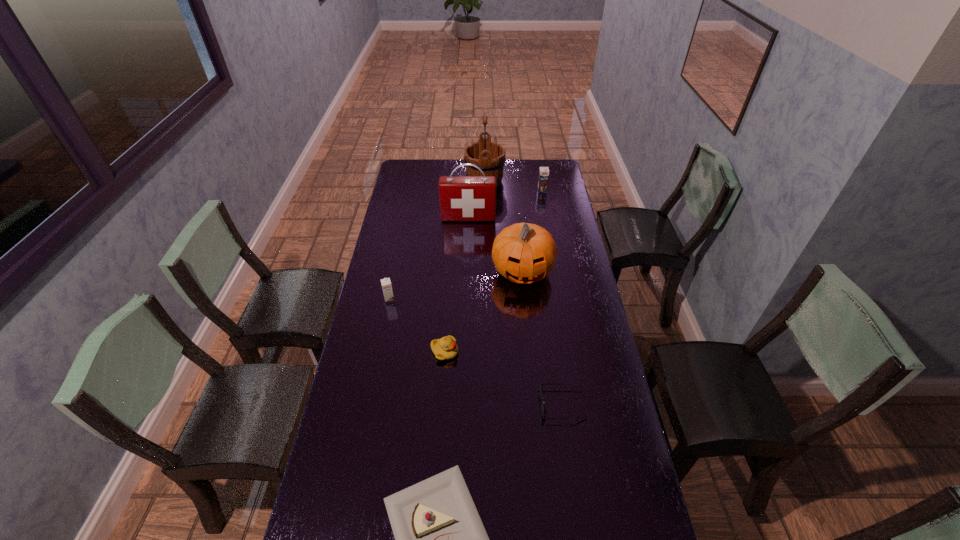
This screenshot has height=540, width=960. What are the coordinates of `free space between the tallest object and the shortest object` in the screenshot? It's located at (523, 293).

I want to click on vacant area that lies between the pumpkin and the duckling, so click(x=484, y=312).

Identify the location of empty location between the right chocolate milk and the duckling. (493, 271).

Locate an element on the screen. The image size is (960, 540). empty space between the farther chocolate milk and the leftmost object is located at coordinates (466, 245).

You are a GUI agent. You are given a task and a screenshot of the screen. Output one action in this format:
    pyautogui.click(x=<x>, y=<y>)
    Task: Click on the free spot between the nearer chocolate milk and the sixth shortest object
    The image size is (960, 540).
    Given the screenshot: What is the action you would take?
    pyautogui.click(x=456, y=286)

I want to click on free space between the first-aid kit and the fifth shortest object, so click(505, 204).

Locate which object is the sixth closest to the tallest object. Please provide its 2D coordinates. Your answer should be formatted as a tuple, i.e. [(x, y)], where the tuple contains the x and y coordinates of a point satisfying the conditions above.

[(544, 411)]

Where is `the fourth closest object to the pumpkin`? The image size is (960, 540). the fourth closest object to the pumpkin is located at coordinates (544, 411).

At what (x,y) coordinates should I click in order to perform the action: click on vacant space that satisfies the following two spatial constraints: 1. on the front label of the farther chocolate milk; 2. on the front-facing side of the shortest object. Please return your answer as a coordinate pair (x, y). Looking at the image, I should click on (581, 404).

Image resolution: width=960 pixels, height=540 pixels. I want to click on free space that satisfies the following two spatial constraints: 1. on the front label of the right chocolate milk; 2. on the front-facing side of the duckling, so click(x=571, y=352).